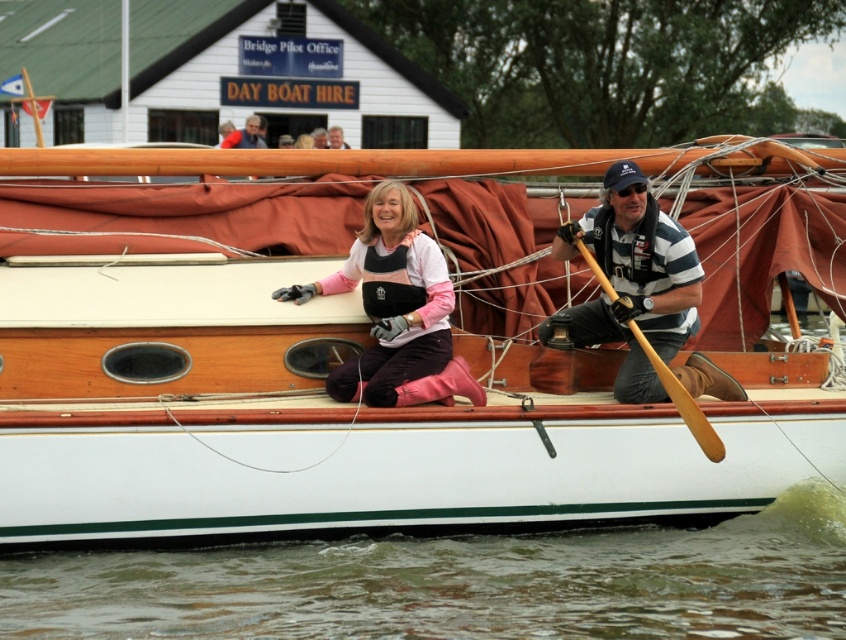
Does white wood boat at center have a lesser width compared to greenish murky water at lower center?

Yes.

Who is positioned more to the right, white wood boat at center or greenish murky water at lower center?

Positioned to the right is white wood boat at center.

You are a GUI agent. You are given a task and a screenshot of the screen. Output one action in this format:
    pyautogui.click(x=<x>, y=<y>)
    Task: Click on the white wood boat at center
    This screenshot has width=846, height=640.
    Given the screenshot: What is the action you would take?
    pyautogui.click(x=389, y=408)

Does pink rubber boots at center appear over wooden paddle at right?

Yes.

Can you confirm if pink rubber boots at center is shorter than wooden paddle at right?

No, pink rubber boots at center is not shorter than wooden paddle at right.

Locate an element on the screen. This screenshot has width=846, height=640. pink rubber boots at center is located at coordinates (396, 310).

Can you confirm if white wood boat at center is wider than smooth brown leather jacket at upper center?

Indeed, white wood boat at center has a greater width compared to smooth brown leather jacket at upper center.

Who is shorter, white wood boat at center or smooth brown leather jacket at upper center?

smooth brown leather jacket at upper center is shorter.

Who is more distant from viewer, (86, 545) or (344, 141)?

The point (344, 141) is behind.

This screenshot has height=640, width=846. What are the coordinates of `white wood boat at center` in the screenshot? It's located at coord(389,408).